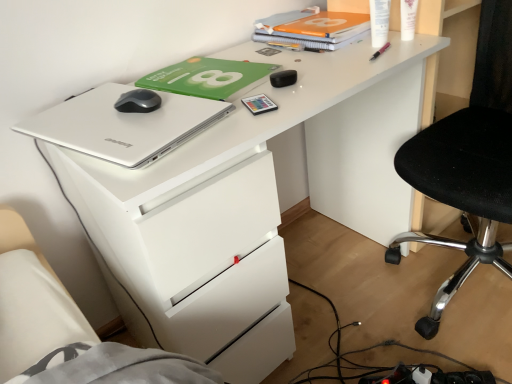
Identify the location of free space in front of satin black mouse at upper left. Image resolution: width=512 pixels, height=384 pixels. (129, 130).